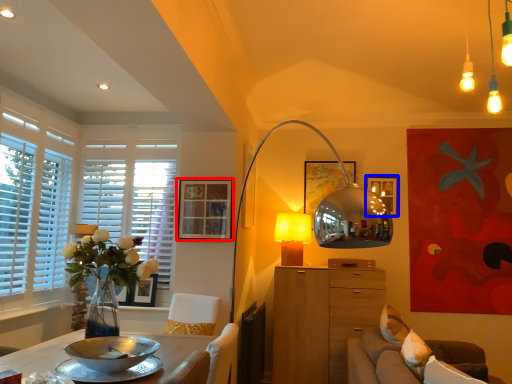
Question: Which point is further to the camera, picture frame (highlighted by a red box) or picture frame (highlighted by a blue box)?

Choices:
 (A) picture frame
 (B) picture frame

Answer: (B)